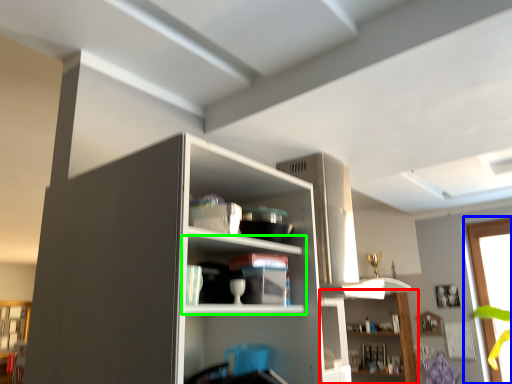
Question: Which object is positioned farthest from shelf (highlighted by a red box)? Select from window (highlighted by a blue box) and shelf (highlighted by a green box).

Choices:
 (A) window
 (B) shelf

Answer: (B)